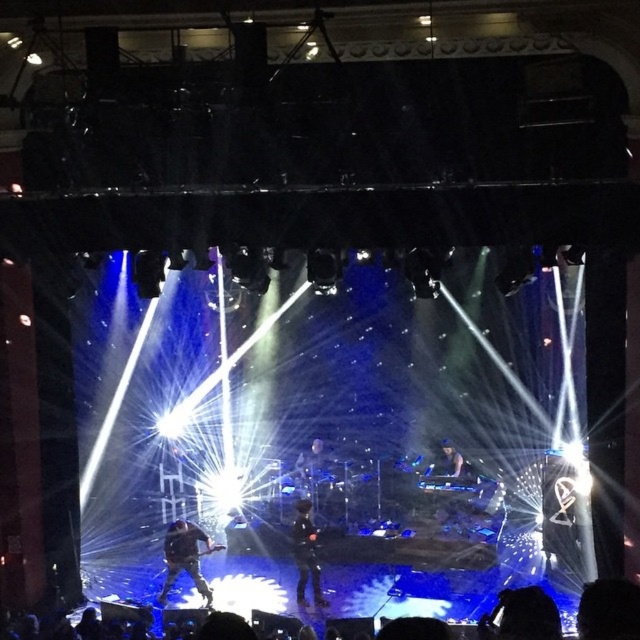
You are a photographer at the live music performance. You want to capture a photo of both the black leather jacket at center and the black matte jacket at center. Which jacket should you adjust your camera focus to first if you want to include both in the frame without moving the camera?

The black leather jacket at center is to the left of black matte jacket at center, so you should focus on the black leather jacket at center first to ensure both are in the frame.

You are a photographer at the live music performance. You need to capture both the black leather jacket at center and the black matte jacket at center in a single shot. Which jacket will appear smaller in the photo?

The black leather jacket at center will appear smaller in the photo because it has a lesser height compared to the black matte jacket at center.

You are a stagehand who needs to place a 1.2 meters wide equipment on the stage. The black leather jacket at center and the black matte jacket at center are currently occupying the center area. Can you fit the equipment between them?

The black leather jacket at center might be wider than black matte jacket at center. If the black leather jacket at center is indeed wider, it could take up more space, making it uncertain whether the 1.2 meters wide equipment can fit between them. You should check the actual width of the black leather jacket at center before deciding.